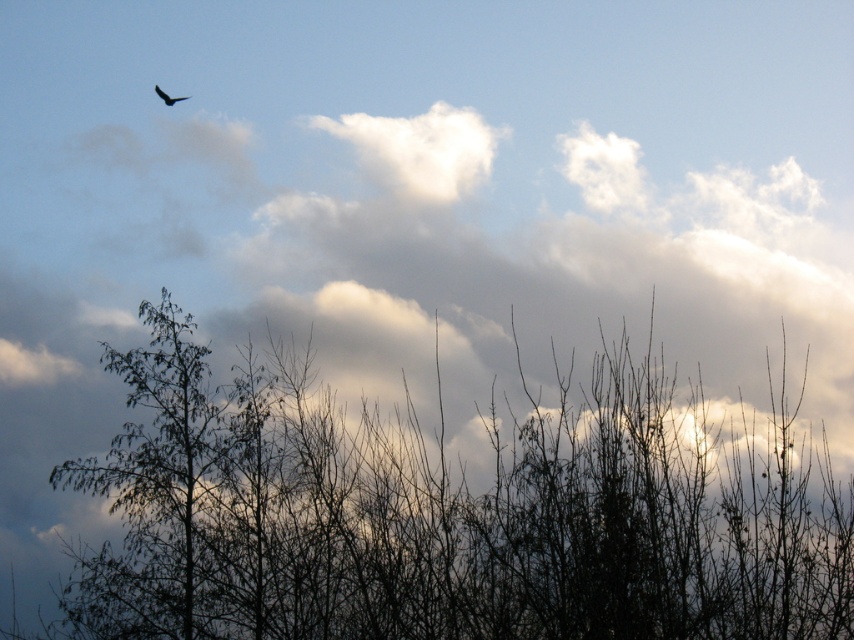
Question: Which point is closer to the camera taking this photo?

Choices:
 (A) (171, 99)
 (B) (176, 333)

Answer: (A)

Question: Is silhouette bare branches at center thinner than dark brown feathered bird at upper left?

Choices:
 (A) no
 (B) yes

Answer: (A)

Question: Does silhouette bare branches at center appear over dark brown feathered bird at upper left?

Choices:
 (A) no
 (B) yes

Answer: (A)

Question: Can you confirm if silhouette bare branches at center is positioned to the left of dark brown feathered bird at upper left?

Choices:
 (A) no
 (B) yes

Answer: (A)